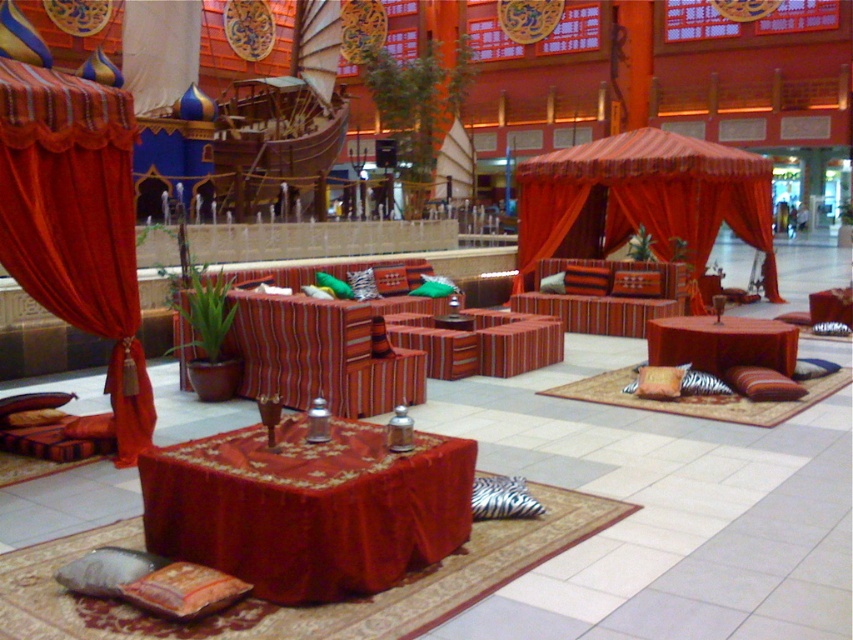
Does velvet red tablecloth at center appear on the left side of matte red fabric canopy bed at center?

Yes, velvet red tablecloth at center is to the left of matte red fabric canopy bed at center.

Is point (289, 516) less distant than point (711, 168)?

Yes, point (289, 516) is closer to viewer.

Who is more forward, (187, 476) or (747, 195)?

Point (187, 476) is more forward.

The image size is (853, 640). In order to click on velvet red tablecloth at center in this screenshot , I will do `click(308, 508)`.

From the picture: Does velvet red curtain at left have a smaller size compared to velvet red table at center?

Incorrect, velvet red curtain at left is not smaller in size than velvet red table at center.

Who is lower down, velvet red curtain at left or velvet red table at center?

velvet red table at center

Find the location of a particular element. The height and width of the screenshot is (640, 853). velvet red curtain at left is located at coordinates (76, 221).

The image size is (853, 640). What are the coordinates of `velvet red curtain at left` in the screenshot? It's located at (76, 221).

Does velvet red tablecloth at center have a greater height compared to velvet red table at center?

Yes, velvet red tablecloth at center is taller than velvet red table at center.

Can you confirm if velvet red tablecloth at center is positioned to the right of velvet red table at center?

No, velvet red tablecloth at center is not to the right of velvet red table at center.

Is point (379, 442) behind point (775, 342)?

No, it is not.

Where is `velvet red tablecloth at center`? Image resolution: width=853 pixels, height=640 pixels. velvet red tablecloth at center is located at coordinates (308, 508).